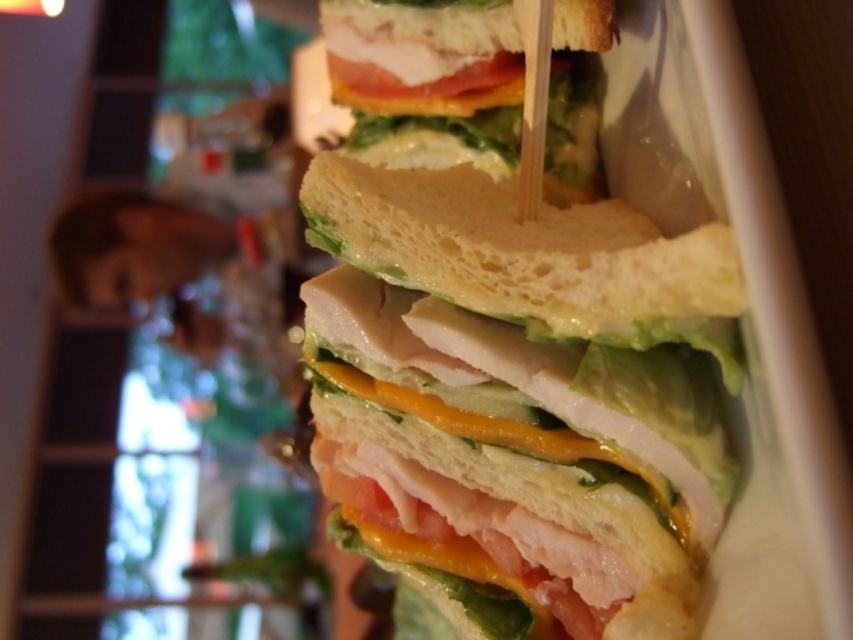
You are at a buffet and see the white bread sandwich at center and the slightly toasted bread at center. Which bread is closer to the top of the sandwich?

The slightly toasted bread at center is closer to the top of the sandwich because the white bread sandwich at center is positioned under it.

You are holding a camera and want to take a photo of the white bread sandwich at center. The camera requires a minimum distance of 18 inches to focus properly. Will you need to move closer or farther away to ensure the sandwich is in focus?

The white bread sandwich at center and camera are 17.95 inches apart from each other. Since the minimum focus distance is 18 inches, you need to move slightly farther away to reach the required distance.

You are at a buffet and want to choose between the white bread sandwich at center and the slightly toasted bread at center based on their height. Which one is taller?

The white bread sandwich at center is taller than the slightly toasted bread at center.